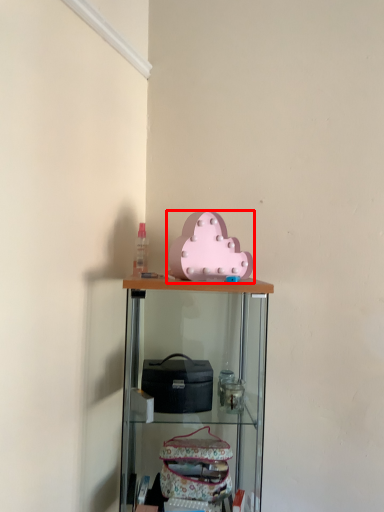
Question: From the image's perspective, what is the correct spatial positioning of toy (annotated by the red box) in reference to shelf?

Choices:
 (A) below
 (B) above

Answer: (B)